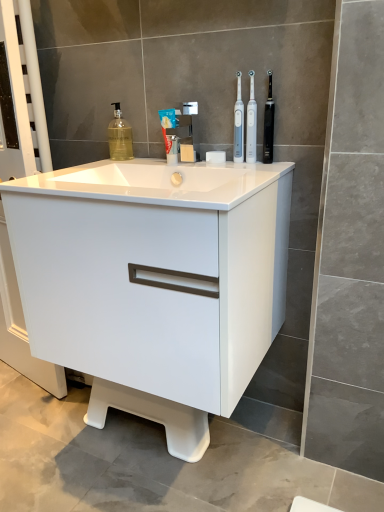
The height and width of the screenshot is (512, 384). What do you see at coordinates (167, 125) in the screenshot? I see `blue matte toothpaste at center` at bounding box center [167, 125].

Locate an element on the screen. This screenshot has height=512, width=384. white plastic toothbrush at center, the first toothbrush from the left is located at coordinates (238, 124).

Describe the element at coordinates (251, 123) in the screenshot. The height and width of the screenshot is (512, 384). I see `white plastic toothbrush at upper center, marked as the 2th toothbrush in a left-to-right arrangement` at that location.

Locate an element on the screen. white plastic toothbrush at upper center, marked as the 2th toothbrush in a left-to-right arrangement is located at coordinates (251, 123).

Locate an element on the screen. The height and width of the screenshot is (512, 384). white glossy sink at center is located at coordinates (156, 182).

Measure the distance between point [267,73] and camera.

The distance of point [267,73] from camera is 1.14 meters.

At what (x,y) coordinates should I click in order to perform the action: click on white glossy cabinet at center. Please return your answer as a coordinate pair (x, y). This screenshot has width=384, height=512. Looking at the image, I should click on (154, 283).

Considering the positions of point (188, 137) and point (179, 188), is point (188, 137) closer or farther from the camera than point (179, 188)?

Clearly, point (188, 137) is more distant from the camera than point (179, 188).

From a real-world perspective, is chrome metallic faucet at upper center physically located above or below white glossy sink at center?

chrome metallic faucet at upper center is above white glossy sink at center.

Measure the distance between chrome metallic faucet at upper center and white glossy sink at center.

They are 24.74 centimeters apart.

This screenshot has height=512, width=384. In order to click on tap located above the white glossy sink at center (from the image's perspective) in this screenshot , I will do `click(185, 131)`.

From the image's perspective, would you say white plastic toothbrush at center, the first toothbrush from the left, is shown under black plastic toothbrush at upper right, which is the 3th toothbrush from left to right?

No.

Is white plastic toothbrush at center, which appears as the 3th toothbrush when viewed from the right, not near black plastic toothbrush at upper right, which is the 3th toothbrush from left to right?

No, there isn't a large distance between white plastic toothbrush at center, which appears as the 3th toothbrush when viewed from the right, and black plastic toothbrush at upper right, which is the 3th toothbrush from left to right.

Could you tell me if white plastic toothbrush at center, which appears as the 3th toothbrush when viewed from the right, is turned towards black plastic toothbrush at upper right, the 1th toothbrush in the right-to-left sequence?

No, white plastic toothbrush at center, which appears as the 3th toothbrush when viewed from the right, is not facing towards black plastic toothbrush at upper right, the 1th toothbrush in the right-to-left sequence.

Consider the image. Is the position of white plastic toothbrush at center, the first toothbrush from the left, less distant than that of black plastic toothbrush at upper right, the 1th toothbrush in the right-to-left sequence?

That is False.

Between point (30, 187) and point (255, 122), which one is positioned in front?

The point (30, 187) is closer to the camera.

Which object is further away from the camera, white glossy sink at center or white plastic toothbrush at upper center, marked as the 2th toothbrush in a left-to-right arrangement?

white plastic toothbrush at upper center, marked as the 2th toothbrush in a left-to-right arrangement.

Between gold metallic soap dispenser at upper left and white glossy cabinet at center, which one is positioned behind?

gold metallic soap dispenser at upper left is further from the camera.

Can we say gold metallic soap dispenser at upper left lies outside white glossy cabinet at center?

That's correct, gold metallic soap dispenser at upper left is outside of white glossy cabinet at center.

Is gold metallic soap dispenser at upper left far away from white glossy cabinet at center?

They are positioned close to each other.

From a real-world perspective, between gold metallic soap dispenser at upper left and white glossy cabinet at center, who is vertically lower?

white glossy cabinet at center, from a real-world perspective.

Looking at the image, does chrome metallic faucet at upper center seem bigger or smaller compared to gold metallic soap dispenser at upper left?

In the image, chrome metallic faucet at upper center appears to be larger than gold metallic soap dispenser at upper left.

Which object is further away from the camera, chrome metallic faucet at upper center or gold metallic soap dispenser at upper left?

gold metallic soap dispenser at upper left is behind.

From the image's perspective, which is below, chrome metallic faucet at upper center or gold metallic soap dispenser at upper left?

chrome metallic faucet at upper center.

From a real-world perspective, is chrome metallic faucet at upper center on top of gold metallic soap dispenser at upper left?

No, from a real-world perspective, chrome metallic faucet at upper center is not above gold metallic soap dispenser at upper left.

How far apart are blue matte toothpaste at center and white plastic toothbrush at upper center, marked as the 2th toothbrush in a left-to-right arrangement?

Answer: They are 23.20 centimeters apart.

From the image's perspective, is blue matte toothpaste at center located beneath white plastic toothbrush at upper center, marked as the 2th toothbrush in a left-to-right arrangement?

Indeed, from the image's perspective, blue matte toothpaste at center is shown beneath white plastic toothbrush at upper center, marked as the 2th toothbrush in a left-to-right arrangement.

Between point (164, 116) and point (253, 129), which one is positioned behind?

Point (164, 116)

Which is more to the left, blue matte toothpaste at center or white plastic toothbrush at upper center, acting as the 2th toothbrush starting from the right?

blue matte toothpaste at center is more to the left.

This screenshot has width=384, height=512. Find the location of `toothpaste on the right of the white glossy cabinet at center`. toothpaste on the right of the white glossy cabinet at center is located at coordinates (167, 125).

What's the angular difference between white glossy cabinet at center and blue matte toothpaste at center's facing directions?

0.699 degrees.

From a real-world perspective, does white glossy cabinet at center stand above blue matte toothpaste at center?

Actually, white glossy cabinet at center is physically below blue matte toothpaste at center in the real world.

Is white glossy cabinet at center smaller than blue matte toothpaste at center?

No, white glossy cabinet at center is not smaller than blue matte toothpaste at center.

This screenshot has width=384, height=512. Find the location of `tap located above the white glossy sink at center (from a real-world perspective)`. tap located above the white glossy sink at center (from a real-world perspective) is located at coordinates (185, 131).

Locate an element on the screen. Image resolution: width=384 pixels, height=512 pixels. the 2nd toothbrush in front when counting from the white plastic toothbrush at center, the first toothbrush from the left is located at coordinates (268, 124).

Looking at the image, which one is located closer to gold metallic soap dispenser at upper left, white plastic toothbrush at center, the first toothbrush from the left, or chrome metallic faucet at upper center?

chrome metallic faucet at upper center is closer to gold metallic soap dispenser at upper left.

Looking at the image, which one is located further to blue matte toothpaste at center, chrome metallic faucet at upper center or white plastic toothbrush at center, which appears as the 3th toothbrush when viewed from the right?

white plastic toothbrush at center, which appears as the 3th toothbrush when viewed from the right.

Looking at this image, from the image, which object appears to be nearer to blue matte toothpaste at center, white plastic toothbrush at upper center, marked as the 2th toothbrush in a left-to-right arrangement, or chrome metallic faucet at upper center?

chrome metallic faucet at upper center.

Estimate the real-world distances between objects in this image. Which object is closer to black plastic toothbrush at upper right, the 1th toothbrush in the right-to-left sequence, gold metallic soap dispenser at upper left or white plastic toothbrush at upper center, marked as the 2th toothbrush in a left-to-right arrangement?

Among the two, white plastic toothbrush at upper center, marked as the 2th toothbrush in a left-to-right arrangement, is located nearer to black plastic toothbrush at upper right, the 1th toothbrush in the right-to-left sequence.

Based on their spatial positions, is white glossy sink at center or white plastic toothbrush at center, the first toothbrush from the left, closer to chrome metallic faucet at upper center?

Based on the image, white plastic toothbrush at center, the first toothbrush from the left, appears to be nearer to chrome metallic faucet at upper center.

Considering their positions, is white glossy cabinet at center positioned closer to white plastic toothbrush at upper center, marked as the 2th toothbrush in a left-to-right arrangement, than chrome metallic faucet at upper center?

chrome metallic faucet at upper center is closer to white plastic toothbrush at upper center, marked as the 2th toothbrush in a left-to-right arrangement.

Which object lies further to the anchor point white plastic toothbrush at center, the first toothbrush from the left, gold metallic soap dispenser at upper left or blue matte toothpaste at center?

gold metallic soap dispenser at upper left is further to white plastic toothbrush at center, the first toothbrush from the left.

From the image, which object appears to be farther from white glossy cabinet at center, white glossy sink at center or gold metallic soap dispenser at upper left?

The object further to white glossy cabinet at center is gold metallic soap dispenser at upper left.

Find the location of a particular element. toothpaste between gold metallic soap dispenser at upper left and white glossy cabinet at center vertically is located at coordinates (167, 125).

Identify the location of bathroom cabinet located between white glossy sink at center and blue matte toothpaste at center in the depth direction. (154, 283).

Identify the location of counter top between chrome metallic faucet at upper center and white glossy cabinet at center in the up-down direction. The width and height of the screenshot is (384, 512). (156, 182).

Where is `toothbrush between gold metallic soap dispenser at upper left and white plastic toothbrush at upper center, marked as the 2th toothbrush in a left-to-right arrangement, in the horizontal direction`? toothbrush between gold metallic soap dispenser at upper left and white plastic toothbrush at upper center, marked as the 2th toothbrush in a left-to-right arrangement, in the horizontal direction is located at coordinates (238, 124).